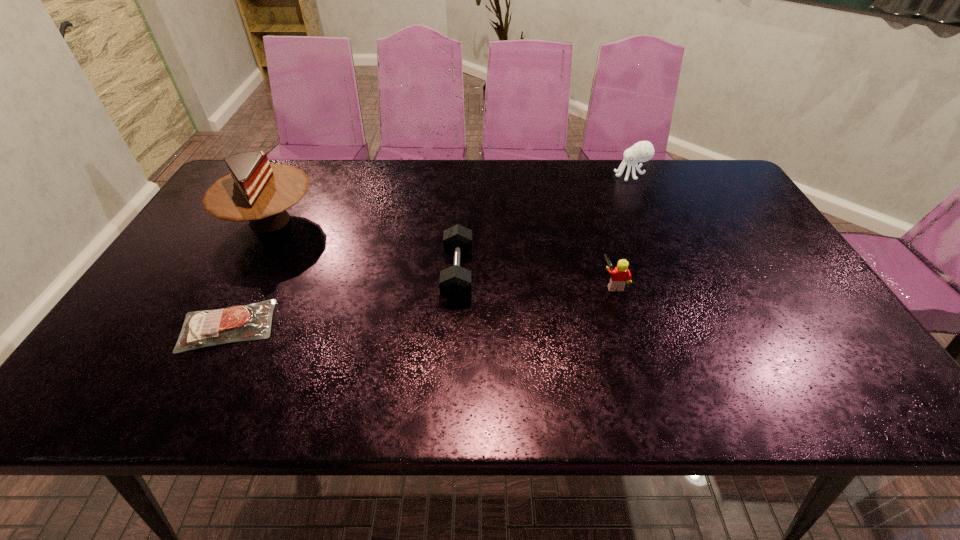
Image resolution: width=960 pixels, height=540 pixels. Identify the location of the tallest object. (256, 191).

Where is `the farthest object`? the farthest object is located at coordinates (642, 151).

The image size is (960, 540). In order to click on the rightmost object in this screenshot , I will do `click(642, 151)`.

Locate an element on the screen. This screenshot has height=540, width=960. Lego is located at coordinates (620, 275).

What are the coordinates of `dumbbell` in the screenshot? It's located at (455, 282).

Identify the location of steak. This screenshot has width=960, height=540. [x=237, y=323].

This screenshot has width=960, height=540. Identify the location of vacant space located on the right of the tallest object. (342, 220).

At what (x,y) coordinates should I click in order to perform the action: click on blank space located 0.230m on the front-facing side of the rightmost object. Please return your answer as a coordinate pair (x, y). This screenshot has width=960, height=540. Looking at the image, I should click on point(545,175).

Find the location of `free location located on the front-facing side of the rightmost object`. free location located on the front-facing side of the rightmost object is located at coordinates (557, 175).

Image resolution: width=960 pixels, height=540 pixels. Find the location of `blank space located on the front-facing side of the rightmost object`. blank space located on the front-facing side of the rightmost object is located at coordinates (533, 175).